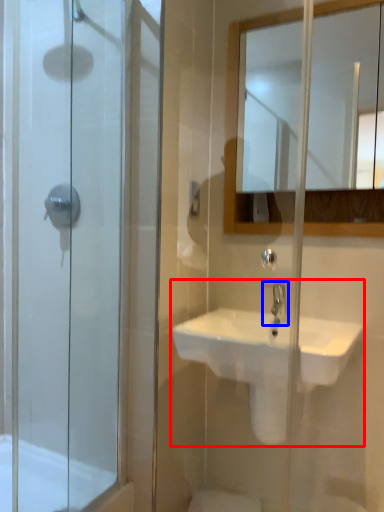
Question: Which point is closer to the camera, sink (highlighted by a red box) or tap (highlighted by a blue box)?

Choices:
 (A) sink
 (B) tap

Answer: (A)